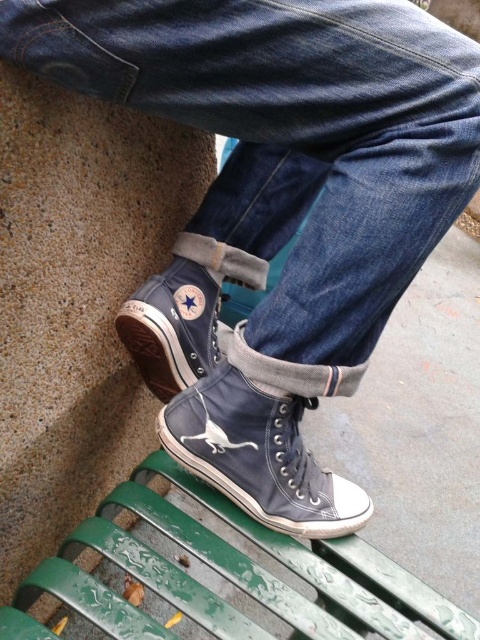
Is denim at center wider than canvas high-top shoe at center?

Yes.

Can you confirm if denim at center is positioned below canvas high-top shoe at center?

Incorrect, denim at center is not positioned below canvas high-top shoe at center.

Identify the location of denim at center. Image resolution: width=480 pixels, height=640 pixels. (290, 147).

Can you confirm if green painted wood park bench at lower center is smaller than canvas high-top sneaker at center?

No.

Who is more forward, (349, 566) or (242, 458)?

Point (242, 458) is more forward.

Locate an element on the screen. This screenshot has height=640, width=480. green painted wood park bench at lower center is located at coordinates (237, 573).

Which is below, green painted wood park bench at lower center or canvas high-top shoe at center?

green painted wood park bench at lower center is lower down.

Which is more to the right, green painted wood park bench at lower center or canvas high-top shoe at center?

green painted wood park bench at lower center

Locate an element on the screen. green painted wood park bench at lower center is located at coordinates (237, 573).

Locate an element on the screen. The width and height of the screenshot is (480, 640). green painted wood park bench at lower center is located at coordinates (237, 573).